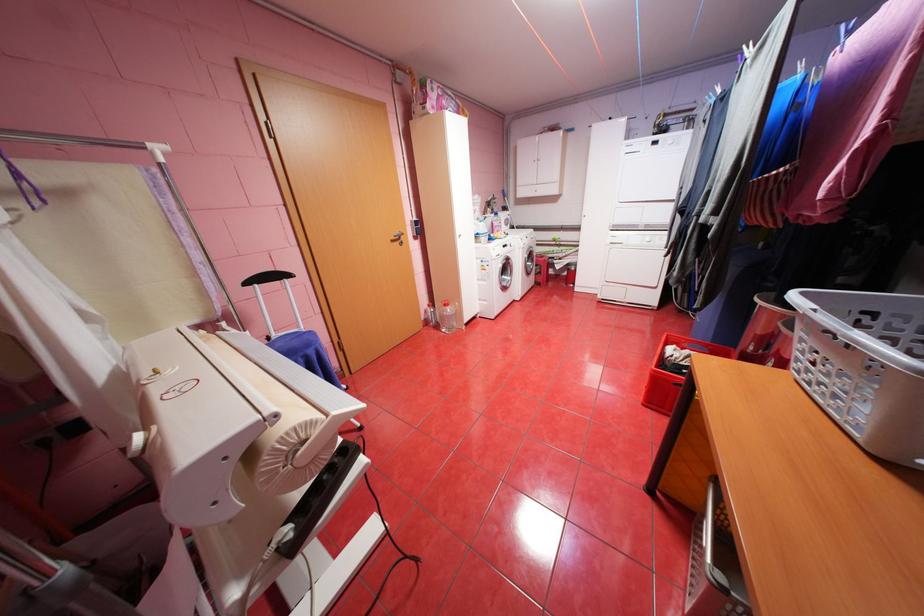
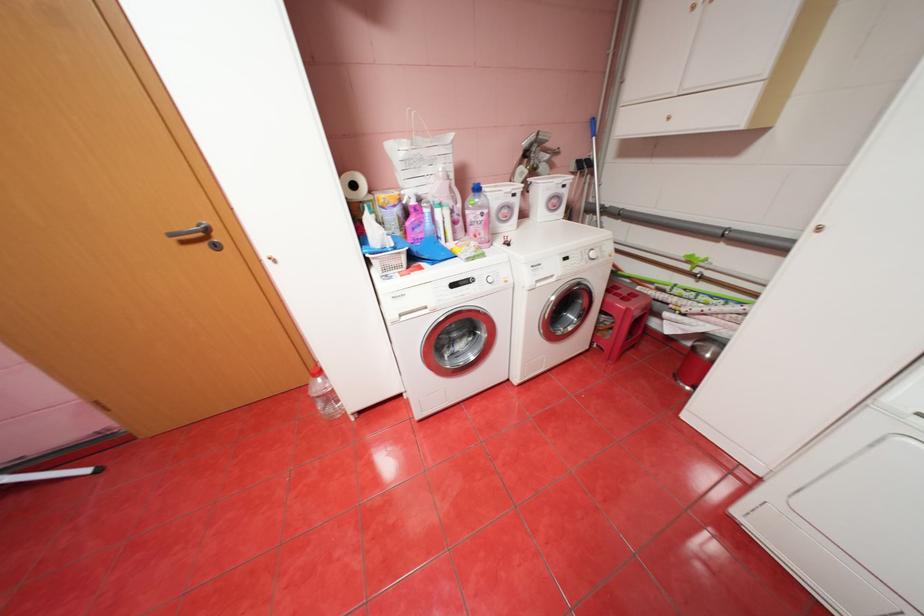
The point at (407,243) is marked in the first image. Where is the corresponding point in the second image?

(213, 245)